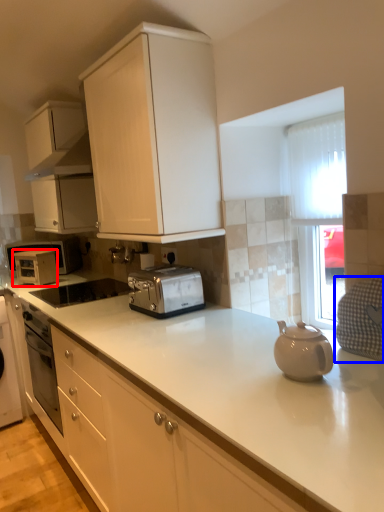
Question: Which object appears closest to the camera in this image, appliance (highlighted by a red box) or gray (highlighted by a blue box)?

Choices:
 (A) appliance
 (B) gray

Answer: (B)